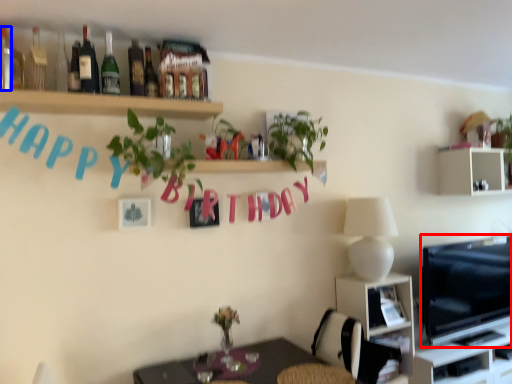
Question: Among these objects, which one is nearest to the camera, television (highlighted by a red box) or bottle (highlighted by a blue box)?

Choices:
 (A) television
 (B) bottle

Answer: (B)